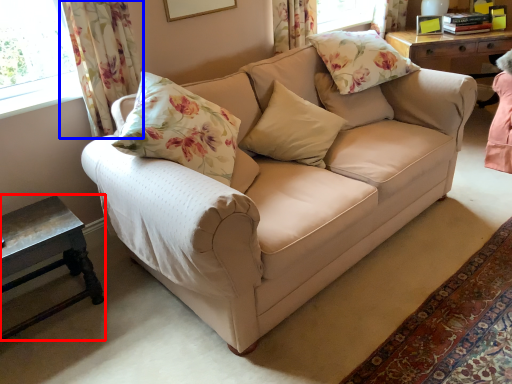
Question: Which of the following is the closest to the observer, table (highlighted by a red box) or curtain (highlighted by a blue box)?

Choices:
 (A) table
 (B) curtain

Answer: (A)